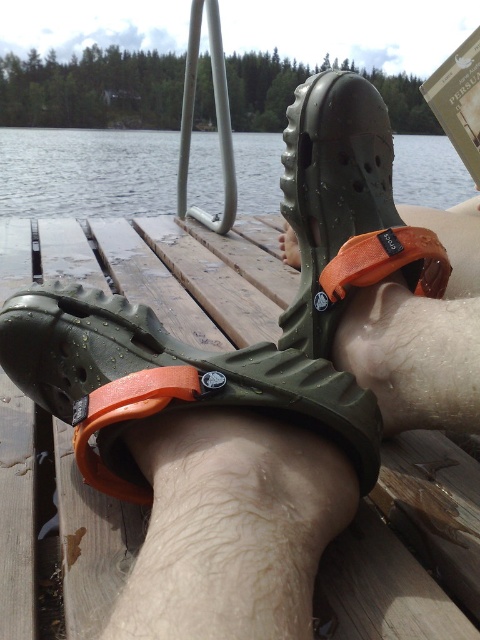
You are taking a photo of the person standing on the wooden dock. The camera is positioned to capture both the olive green Crocs with orange straps and the wet dock surface. Which of the two points, point (72, 301) or point (126, 180), will appear larger in the photo?

Point (72, 301) will appear larger in the photo because it is closer to the camera than point (126, 180).

You are standing on a wooden dock and want to step into the water. Based on the scene, can you tell if the olive green rubber sandal at center is blocking your path to the clear water at dock center?

The olive green rubber sandal at center is in front of clear water at dock center, so it is blocking your path to the clear water at dock center.

You are planning to place a small potted plant between the olive green rubber sandal at center and the clear water at dock center. Based on their sizes, which object should the plant be closer to?

The olive green rubber sandal at center occupies less space than clear water at dock center, so the plant should be placed closer to the clear water at dock center to ensure there is enough space.